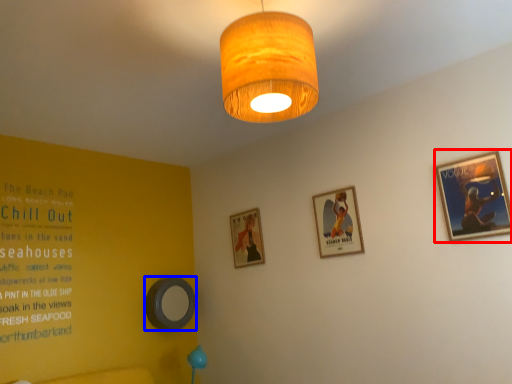
Question: Among these objects, which one is farthest to the camera, picture frame (highlighted by a red box) or picture frame (highlighted by a blue box)?

Choices:
 (A) picture frame
 (B) picture frame

Answer: (B)